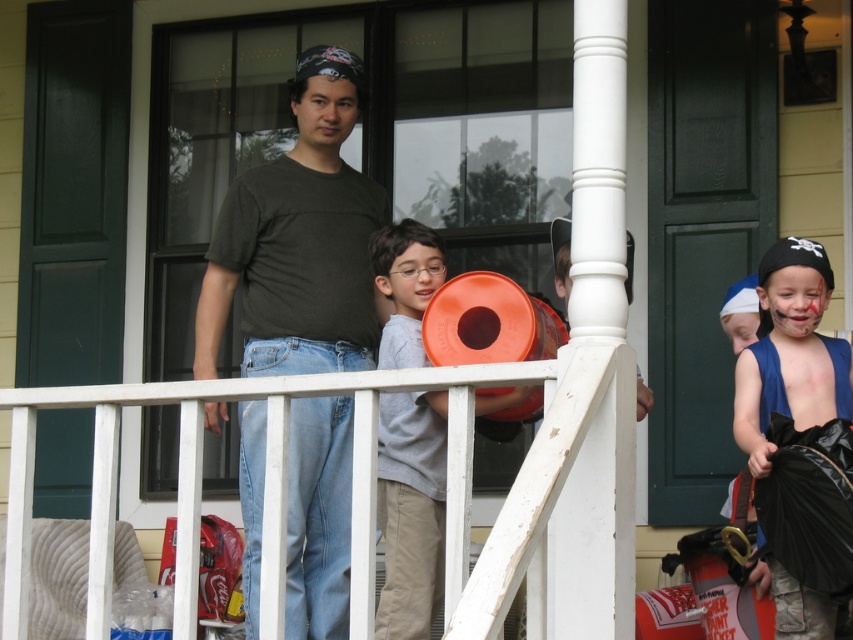
Question: Can you confirm if orange matte bucket at center is positioned to the left of shiny blue fabric at right?

Choices:
 (A) yes
 (B) no

Answer: (A)

Question: Does white wooden rail at center have a smaller size compared to orange matte bucket at center?

Choices:
 (A) yes
 (B) no

Answer: (B)

Question: Which object appears closest to the camera in this image?

Choices:
 (A) dark green t-shirt at center
 (B) shiny blue fabric at right
 (C) orange matte bucket at center
 (D) white wooden rail at center

Answer: (D)

Question: Based on their relative distances, which object is nearer to the shiny blue fabric at right?

Choices:
 (A) orange matte bucket at center
 (B) dark green t-shirt at center
 (C) white wooden rail at center

Answer: (A)

Question: Which point is farther from the camera taking this photo?

Choices:
 (A) (393, 572)
 (B) (779, 292)

Answer: (B)

Question: Does dark green t-shirt at center have a greater width compared to shiny blue fabric at right?

Choices:
 (A) no
 (B) yes

Answer: (B)